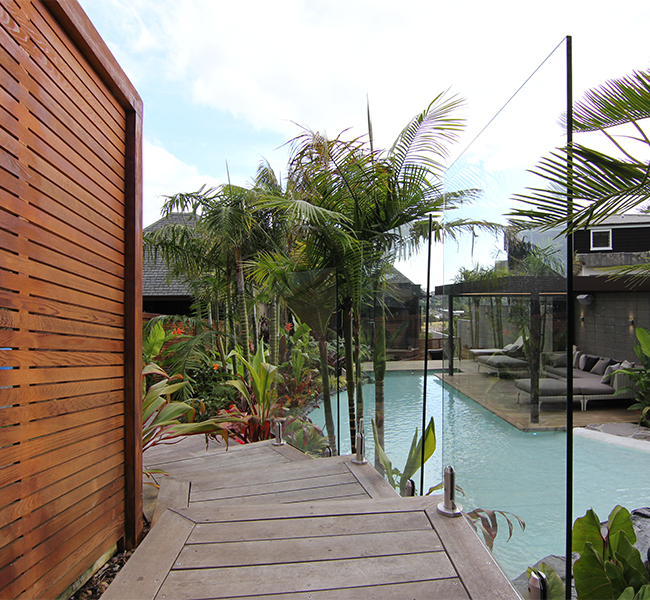
Identify the location of lounger. (547, 388), (482, 345).